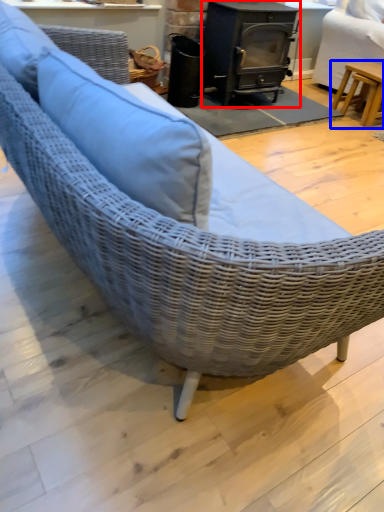
Question: Which object appears closest to the camera in this image, wood burning stove (highlighted by a red box) or table (highlighted by a blue box)?

Choices:
 (A) wood burning stove
 (B) table

Answer: (A)